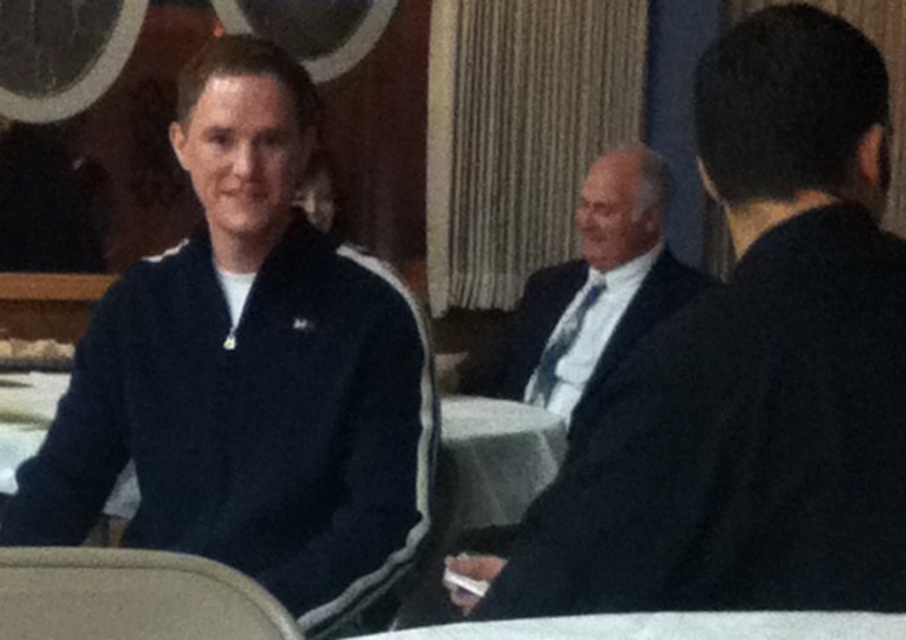
You are standing in front of the image and want to locate the navy blue jacket at left. Where is it positioned in terms of coordinates?

The navy blue jacket at left is positioned at coordinates 0.584 on the x axis and 0.276 on the y axis.